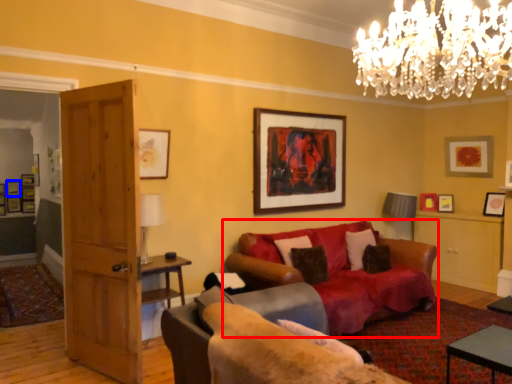
Question: Among these objects, which one is farthest to the camera, studio couch (highlighted by a red box) or picture frame (highlighted by a blue box)?

Choices:
 (A) studio couch
 (B) picture frame

Answer: (B)